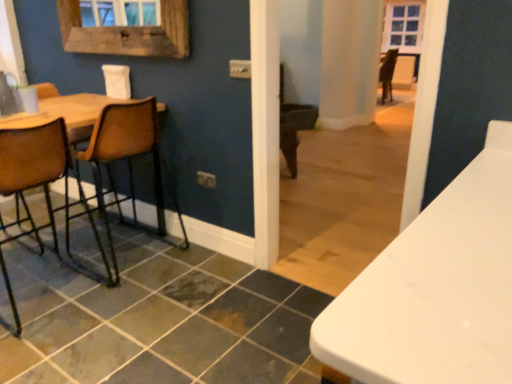
Identify the location of free space in front of brown leather chair at left, which is the 2th chair from left to right. The image size is (512, 384). (136, 312).